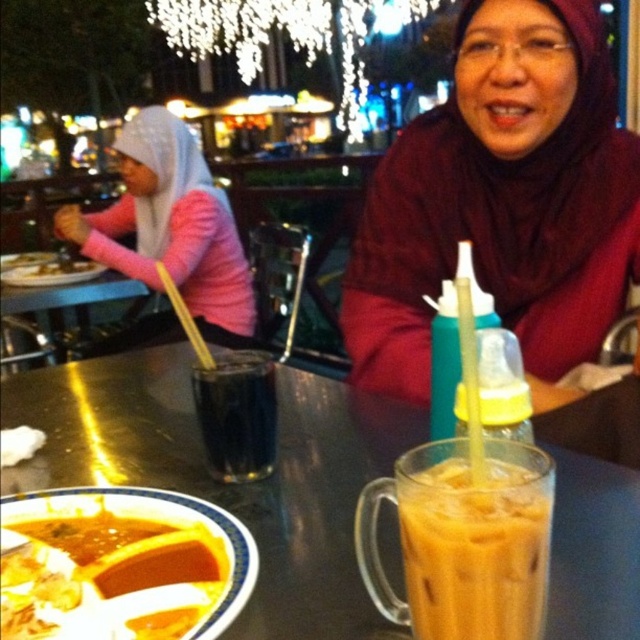
Can you confirm if maroon fabric hijab at upper center is smaller than iced yellowish-brown liquid at lower center?

Actually, maroon fabric hijab at upper center might be larger than iced yellowish-brown liquid at lower center.

Can you confirm if maroon fabric hijab at upper center is positioned above iced yellowish-brown liquid at lower center?

Indeed, maroon fabric hijab at upper center is positioned over iced yellowish-brown liquid at lower center.

Is point (435, 145) closer to viewer compared to point (524, 572)?

No.

The width and height of the screenshot is (640, 640). Identify the location of maroon fabric hijab at upper center. (502, 202).

Is point (225, 332) farther from viewer compared to point (268, 385)?

Yes, it is.

Can you confirm if pink fabric hijab at upper left is wider than black glass at center?

Correct, the width of pink fabric hijab at upper left exceeds that of black glass at center.

Is point (243, 288) in front of point (248, 474)?

No, it is behind (248, 474).

Identify the location of pink fabric hijab at upper left. (170, 227).

Is maroon fabric hijab at upper center positioned at the back of smooth orange soup at lower left?

Yes, it is behind smooth orange soup at lower left.

Which is more to the right, maroon fabric hijab at upper center or smooth orange soup at lower left?

maroon fabric hijab at upper center

This screenshot has height=640, width=640. What are the coordinates of `maroon fabric hijab at upper center` in the screenshot? It's located at (502, 202).